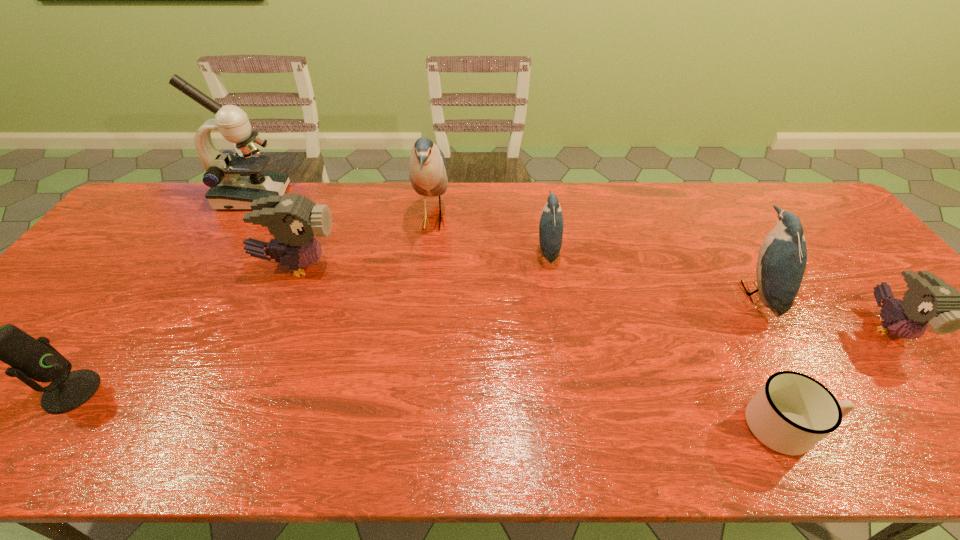
Where is `the tallest object`? This screenshot has width=960, height=540. the tallest object is located at coordinates (236, 180).

Locate an element on the screen. Image resolution: width=960 pixels, height=540 pixels. the second bird from left to right is located at coordinates (427, 170).

This screenshot has width=960, height=540. What are the coordinates of `the leftmost blue bird` in the screenshot? It's located at (427, 170).

Locate an element on the screen. The height and width of the screenshot is (540, 960). the second smallest blue bird is located at coordinates (782, 258).

Identify the location of the fourth bird from left to right. (782, 258).

This screenshot has width=960, height=540. Identify the location of the leftmost bird. (293, 220).

At what (x,y) coordinates should I click in order to perform the action: click on the left gray bird. Please return your answer as a coordinate pair (x, y). This screenshot has height=540, width=960. Looking at the image, I should click on (293, 220).

At what (x,y) coordinates should I click in order to perform the action: click on microphone. Please return your answer as a coordinate pair (x, y). Looking at the image, I should click on (30, 358).

This screenshot has height=540, width=960. I want to click on the fifth object from left to right, so click(x=551, y=225).

Find the location of a particular element. The width and height of the screenshot is (960, 540). the smallest blue bird is located at coordinates (551, 225).